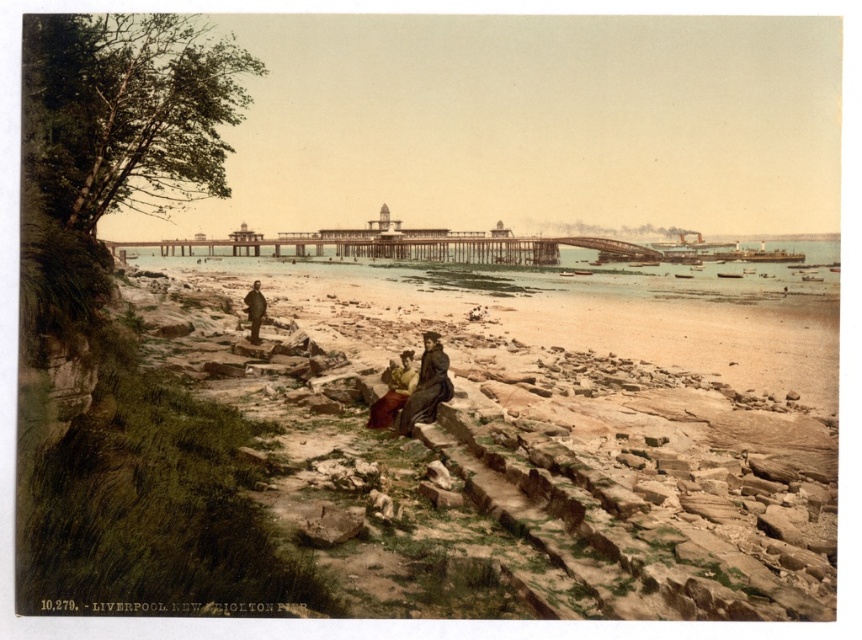
Who is taller, clear water at center or matte yellow dress at center?

With more height is clear water at center.

Does clear water at center have a smaller size compared to matte yellow dress at center?

Actually, clear water at center might be larger than matte yellow dress at center.

Does point (611, 244) lie in front of point (410, 387)?

No, it is not.

Where is `clear water at center`? Image resolution: width=862 pixels, height=640 pixels. clear water at center is located at coordinates (547, 260).

Does clear water at center have a smaller size compared to matte brown dress at center?

No, clear water at center is not smaller than matte brown dress at center.

Can you confirm if clear water at center is positioned to the right of matte brown dress at center?

Indeed, clear water at center is positioned on the right side of matte brown dress at center.

Who is more distant from viewer, (673, 253) or (398, 429)?

The point (673, 253) is behind.

Image resolution: width=862 pixels, height=640 pixels. I want to click on clear water at center, so click(547, 260).

Between smooth sand beach at lower center and matte yellow dress at center, which one has more height?

With more height is smooth sand beach at lower center.

The image size is (862, 640). Describe the element at coordinates (601, 445) in the screenshot. I see `smooth sand beach at lower center` at that location.

This screenshot has width=862, height=640. What do you see at coordinates (601, 445) in the screenshot? I see `smooth sand beach at lower center` at bounding box center [601, 445].

Find the location of a particular element. The height and width of the screenshot is (640, 862). smooth sand beach at lower center is located at coordinates (601, 445).